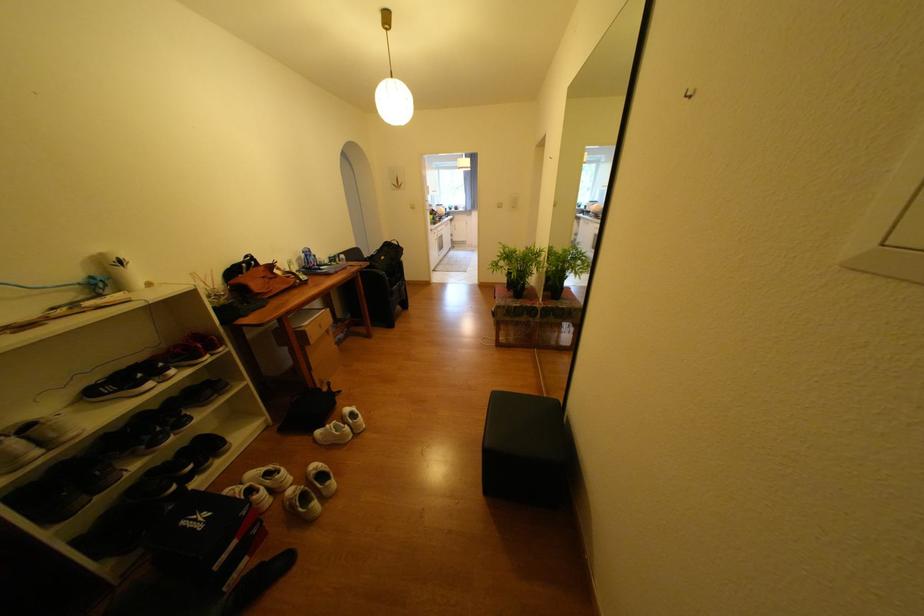
You are a GUI agent. You are given a task and a screenshot of the screen. Output one action in this format:
    pyautogui.click(x=<x>, y=<y>)
    Task: Click on the black stool
    This screenshot has width=924, height=616.
    Given the screenshot: What is the action you would take?
    pyautogui.click(x=495, y=158)